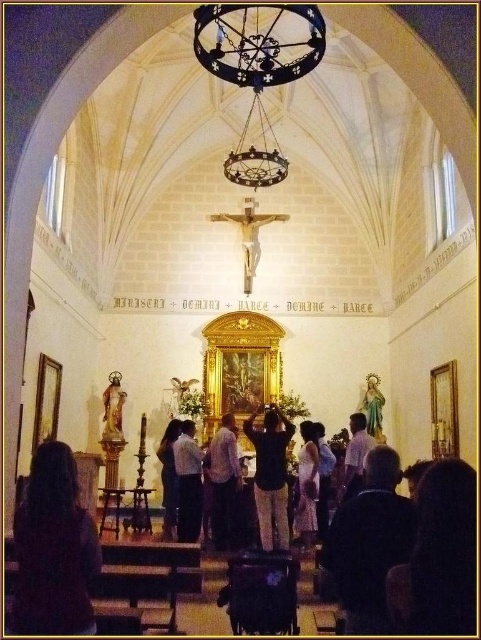
Can you confirm if white shirt at center is smaller than light brown fabric dress at center?

No.

What do you see at coordinates (355, 454) in the screenshot? I see `white shirt at center` at bounding box center [355, 454].

Locate an element on the screen. The image size is (481, 640). white shirt at center is located at coordinates (355, 454).

Can you confirm if dark brown hair at lower left is wider than black fabric dress at center?

Correct, the width of dark brown hair at lower left exceeds that of black fabric dress at center.

Which is below, dark brown hair at lower left or black fabric dress at center?

black fabric dress at center is lower down.

At what (x,y) coordinates should I click in order to perform the action: click on dark brown hair at lower left. Please return your answer as a coordinate pair (x, y). The width and height of the screenshot is (481, 640). Looking at the image, I should click on (53, 548).

Is dark fabric jacket at lower right below matte gold statue at right?

Yes, dark fabric jacket at lower right is below matte gold statue at right.

Can you confirm if dark fabric jacket at lower right is smaller than matte gold statue at right?

Incorrect, dark fabric jacket at lower right is not smaller in size than matte gold statue at right.

Image resolution: width=481 pixels, height=640 pixels. I want to click on dark fabric jacket at lower right, so click(368, 541).

Locate an element on the screen. The width and height of the screenshot is (481, 640). dark fabric jacket at lower right is located at coordinates (368, 541).